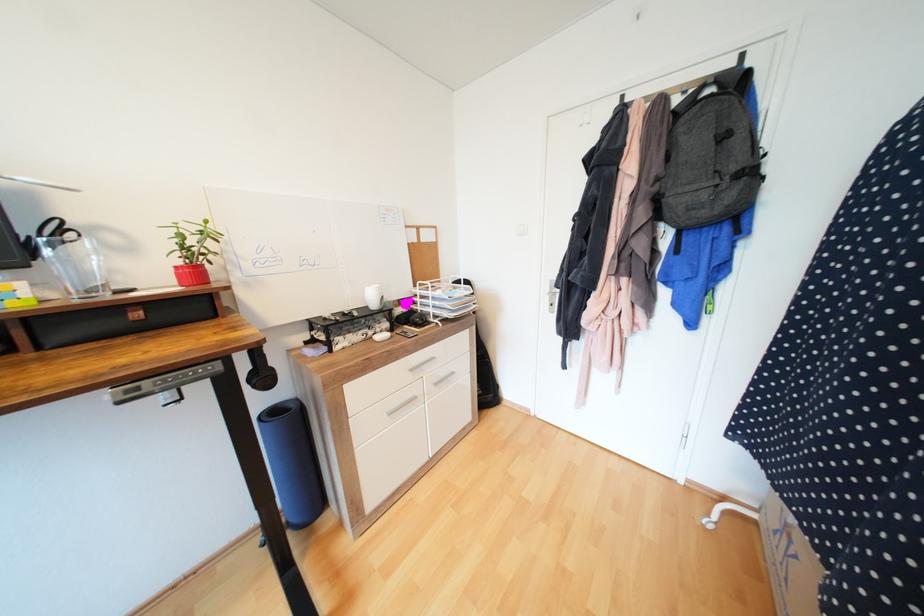
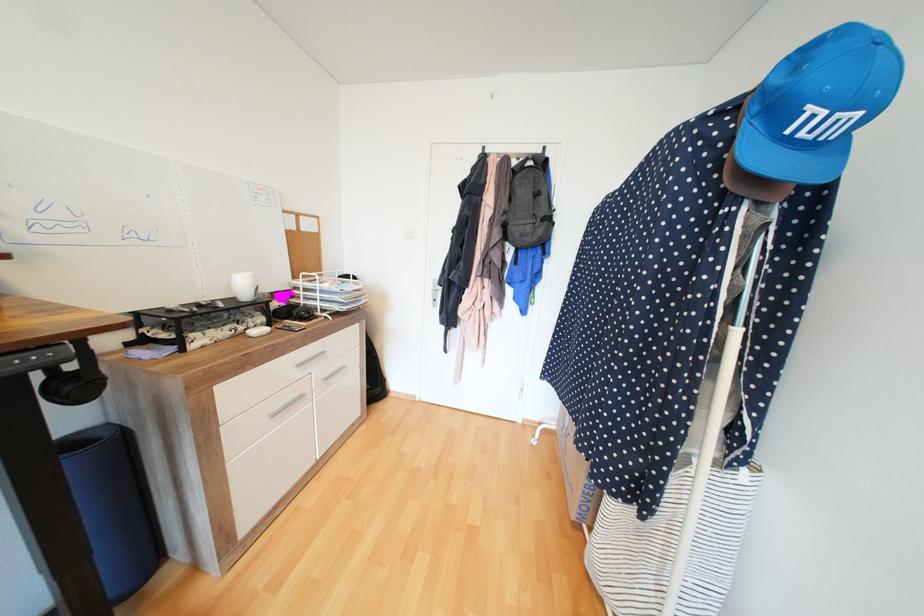
Locate, in the second image, the point that corresponds to [383,338] in the first image.

(260, 333)